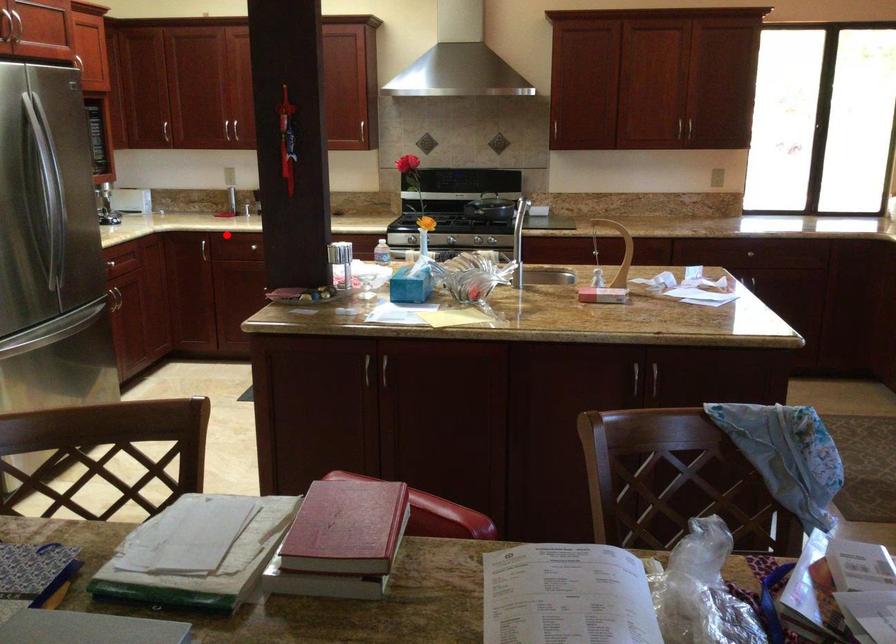
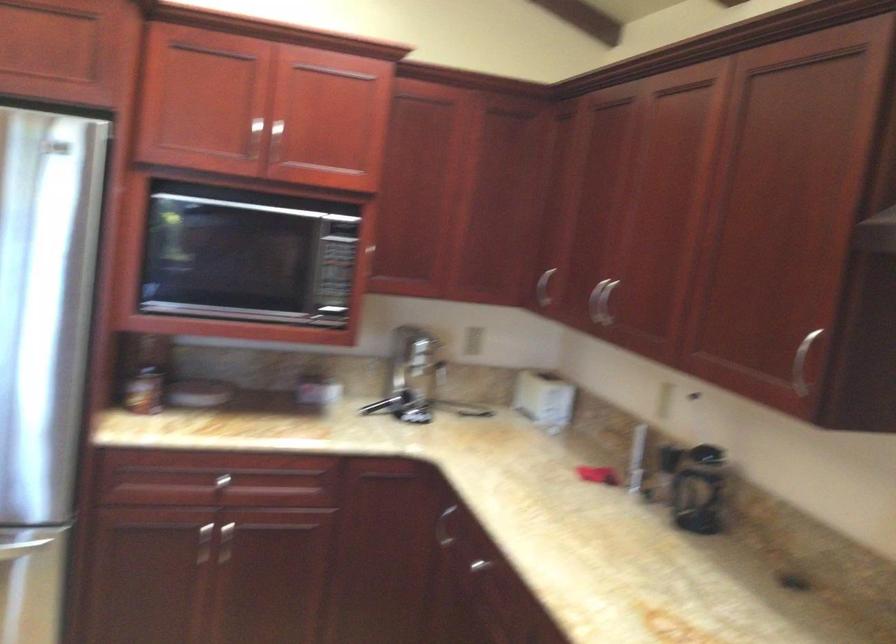
Question: I am providing you with two images of the same scene from different viewpoints. Given a red point in image1, look at the same physical point in image2. Is it:

Choices:
 (A) Closer to the viewpoint
 (B) Farther from the viewpoint

Answer: (A)